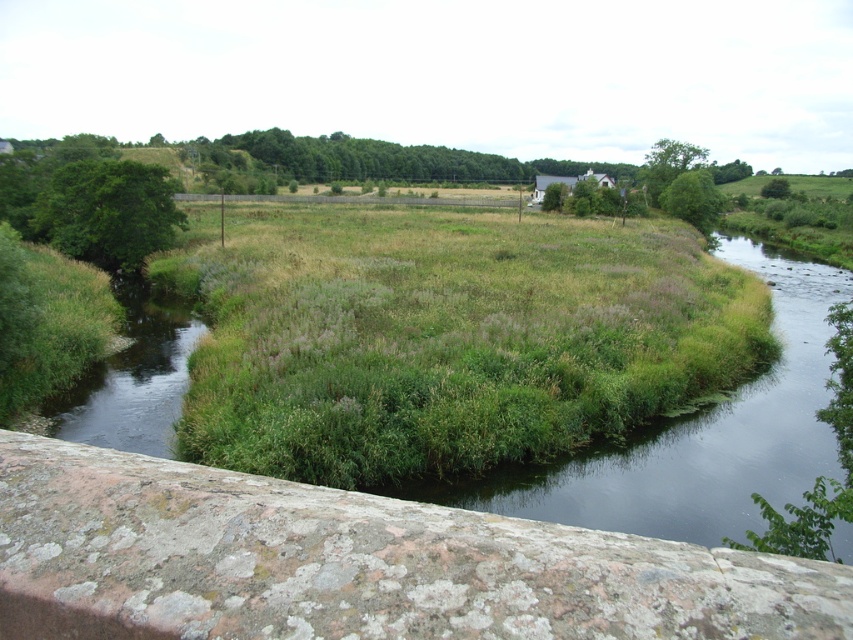
From the picture: Is green grassy patch at center to the right of green grassy stream at left from the viewer's perspective?

Correct, you'll find green grassy patch at center to the right of green grassy stream at left.

This screenshot has height=640, width=853. What do you see at coordinates (445, 337) in the screenshot?
I see `green grassy patch at center` at bounding box center [445, 337].

The image size is (853, 640). What are the coordinates of `green grassy patch at center` in the screenshot? It's located at click(445, 337).

Does green grassy patch at center have a larger size compared to green grassy water at center?

Correct, green grassy patch at center is larger in size than green grassy water at center.

Consider the image. Who is more forward, [300,378] or [683,515]?

Point [683,515] is in front.

Identify the location of green grassy patch at center. (445, 337).

Does green grassy water at center appear over green grassy stream at left?

Indeed, green grassy water at center is positioned over green grassy stream at left.

Is point (479, 483) more distant than point (136, 353)?

No.

You are a GUI agent. You are given a task and a screenshot of the screen. Output one action in this format:
    pyautogui.click(x=<x>, y=<y>)
    Task: Click on the green grassy water at center
    Image resolution: width=853 pixels, height=640 pixels.
    Given the screenshot: What is the action you would take?
    pyautogui.click(x=693, y=436)